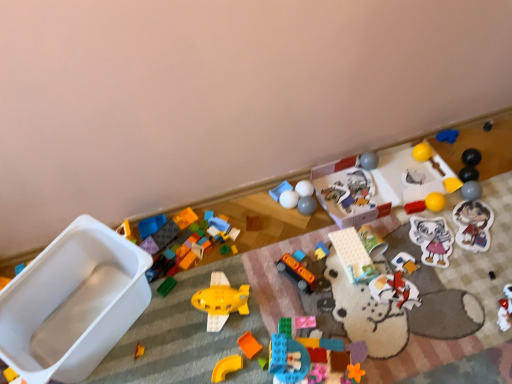
Where is `free space between matte plastic stickers at lower right, the 23th toy viewed from the left, and white plastic container at left, arranged as the 25th toy when viewed from the right`? Image resolution: width=512 pixels, height=384 pixels. free space between matte plastic stickers at lower right, the 23th toy viewed from the left, and white plastic container at left, arranged as the 25th toy when viewed from the right is located at coordinates (306, 286).